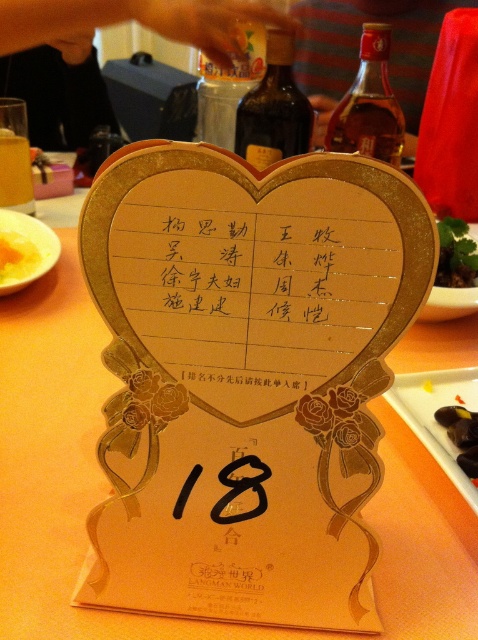
You are at the table where the heart shaped card is placed. You need to place a yellow matte plate at lower left. Where exactly should you place it?

The yellow matte plate at lower left should be placed at point (25,250).

You are a guest at a dinner and see the white plastic tray at lower right and the yellow matte plate at lower left on the table. Which one is positioned closer to the edge of the table?

The white plastic tray at lower right is below the yellow matte plate at lower left, so it is closer to the edge of the table.